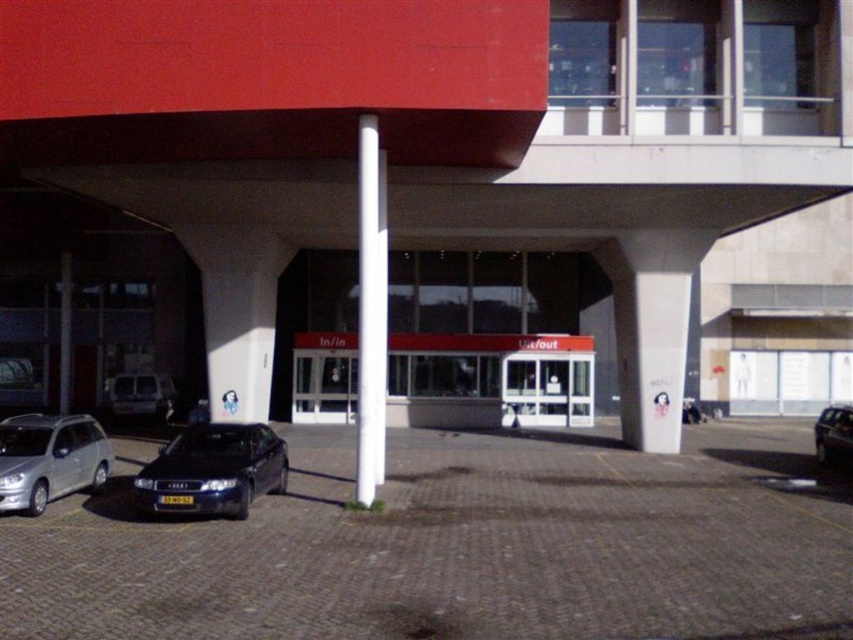
Question: Which object appears closest to the camera in this image?

Choices:
 (A) white glass doors at center
 (B) matte red parking garage at center
 (C) silver metallic hatchback at lower left

Answer: (C)

Question: Does white glass doors at center appear on the right side of silver metallic van at left?

Choices:
 (A) no
 (B) yes

Answer: (B)

Question: Is matte red parking garage at center thinner than gray cobblestone parking lot at center?

Choices:
 (A) no
 (B) yes

Answer: (A)

Question: Based on their relative distances, which object is nearer to the gray cobblestone parking lot at center?

Choices:
 (A) silver metallic van at left
 (B) matte red parking garage at center

Answer: (B)

Question: Can you confirm if gray cobblestone parking lot at center is wider than white glossy pole at center?

Choices:
 (A) no
 (B) yes

Answer: (B)

Question: Among these objects, which one is farthest from the camera?

Choices:
 (A) metallic silver car at lower right
 (B) white glossy pole at center
 (C) silver metallic hatchback at lower left
 (D) shiny black sedan at lower left

Answer: (A)